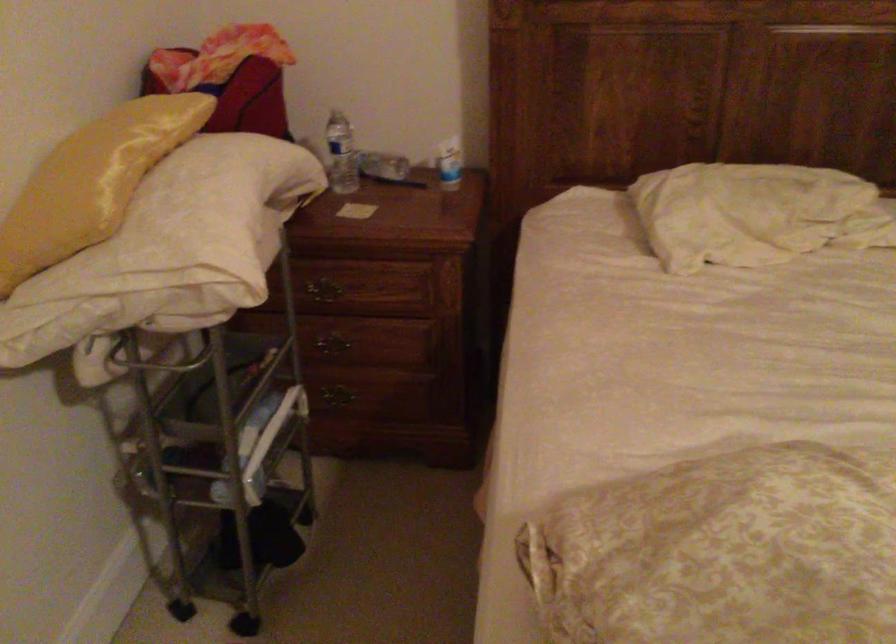
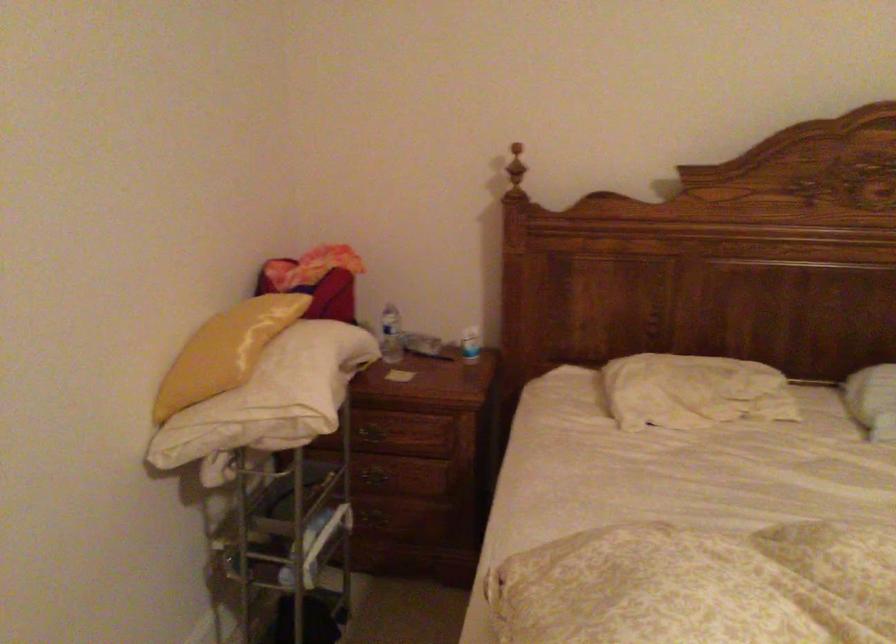
Find the pixel in the second image that matches point (82, 184) in the first image.

(225, 351)